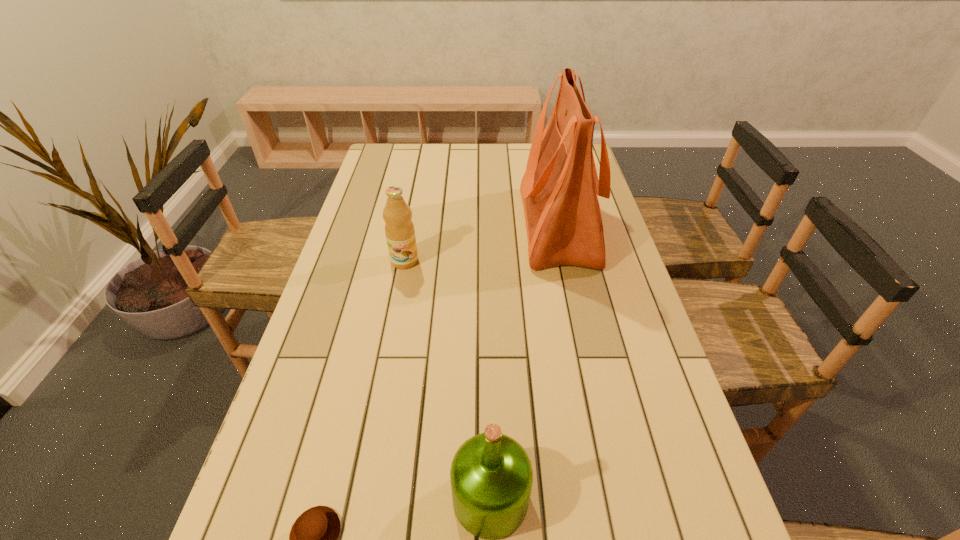
Identify the location of the rightmost object. (559, 189).

Where is `the tallest object`? The height and width of the screenshot is (540, 960). the tallest object is located at coordinates (559, 189).

Where is `the farther olive oil`? Image resolution: width=960 pixels, height=540 pixels. the farther olive oil is located at coordinates (399, 229).

Image resolution: width=960 pixels, height=540 pixels. What are the coordinates of `vacant point located 0.380m on the front pocket of the tallest object` in the screenshot? It's located at (395, 226).

I want to click on vacant space located 0.350m on the front pocket of the tallest object, so click(404, 226).

This screenshot has width=960, height=540. I want to click on free space located on the front pocket of the tallest object, so click(x=479, y=226).

I want to click on vacant space located 0.290m on the label of the farther olive oil, so click(386, 356).

The height and width of the screenshot is (540, 960). I want to click on object present at the left edge, so click(x=399, y=229).

This screenshot has height=540, width=960. I want to click on object that is at the right edge, so click(x=559, y=189).

Where is `free point at the far edge`? This screenshot has width=960, height=540. free point at the far edge is located at coordinates (438, 165).